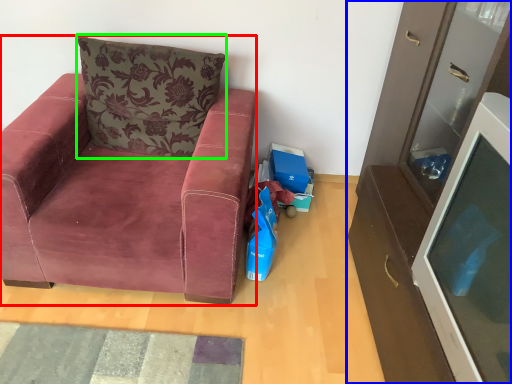
Question: Which is farther away from chair (highlighted by a red box)? cabinetry (highlighted by a blue box) or pillow (highlighted by a green box)?

Choices:
 (A) cabinetry
 (B) pillow

Answer: (A)